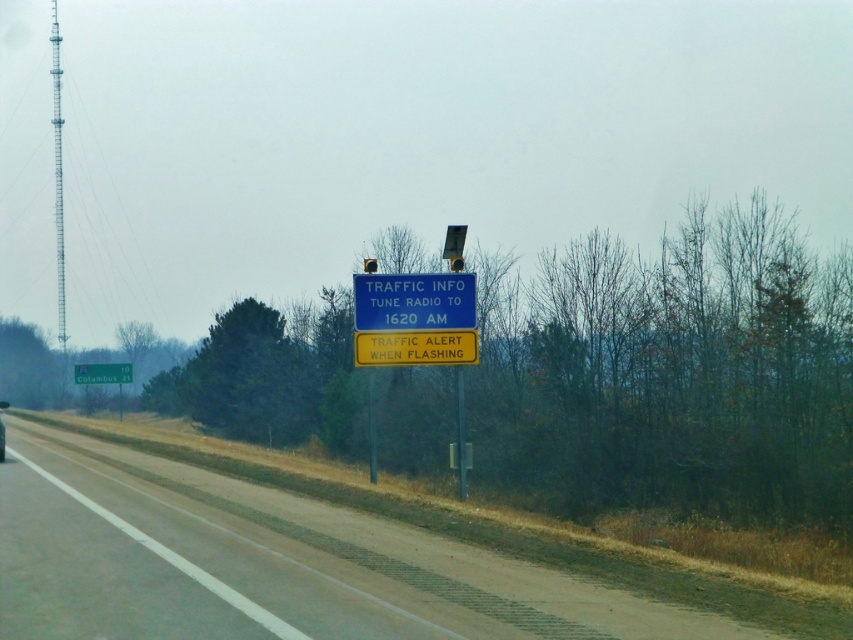
Between yellow plastic traffic sign at center and metallic pole at center, which one is positioned lower?

metallic pole at center

Does point (439, 333) lie in front of point (463, 481)?

That is False.

You are a GUI agent. You are given a task and a screenshot of the screen. Output one action in this format:
    pyautogui.click(x=<x>, y=<y>)
    Task: Click on the yellow plastic traffic sign at center
    The height and width of the screenshot is (640, 853).
    Given the screenshot: What is the action you would take?
    pyautogui.click(x=415, y=348)

Which is behind, point (456, 340) or point (128, 372)?

Positioned behind is point (128, 372).

This screenshot has height=640, width=853. I want to click on yellow plastic traffic sign at center, so click(415, 348).

Who is more distant from viewer, (404, 333) or (123, 369)?

Positioned behind is point (123, 369).

Image resolution: width=853 pixels, height=640 pixels. I want to click on yellow plastic traffic sign at center, so (x=415, y=348).

What do you see at coordinates (102, 372) in the screenshot?
I see `yellow plastic sign at center` at bounding box center [102, 372].

Based on the photo, who is shorter, yellow plastic sign at center or metallic pole at center?

With less height is metallic pole at center.

Is point (83, 369) closer to camera compared to point (461, 497)?

No.

Where is `yellow plastic sign at center`? The image size is (853, 640). yellow plastic sign at center is located at coordinates (102, 372).